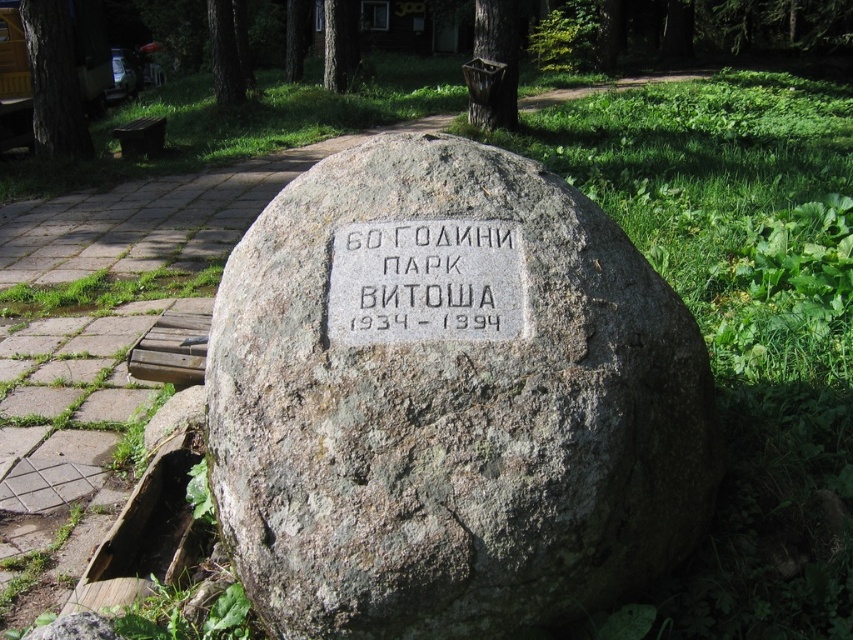
Consider the image. Is gray stone plaque at center positioned before smooth brown wooden basket at upper center?

Yes, gray stone plaque at center is in front of smooth brown wooden basket at upper center.

Which is below, gray stone plaque at center or smooth brown wooden basket at upper center?

gray stone plaque at center is lower down.

Is point (422, 232) closer to camera compared to point (509, 49)?

Yes, it is.

This screenshot has width=853, height=640. I want to click on gray stone plaque at center, so click(425, 282).

Who is higher up, smooth brown wooden basket at upper center or green leafy tree at upper center?

Positioned higher is green leafy tree at upper center.

Is smooth brown wooden basket at upper center to the left of green leafy tree at upper center from the viewer's perspective?

In fact, smooth brown wooden basket at upper center is to the right of green leafy tree at upper center.

Locate an element on the screen. This screenshot has width=853, height=640. smooth brown wooden basket at upper center is located at coordinates 492,65.

Is gray stone plaque at center shorter than green textured tree at upper center?

Indeed, gray stone plaque at center has a lesser height compared to green textured tree at upper center.

Is gray stone plaque at center thinner than green textured tree at upper center?

Yes, gray stone plaque at center is thinner than green textured tree at upper center.

Which is behind, point (517, 336) or point (344, 60)?

Positioned behind is point (344, 60).

Locate an element on the screen. Image resolution: width=853 pixels, height=640 pixels. gray stone plaque at center is located at coordinates (425, 282).